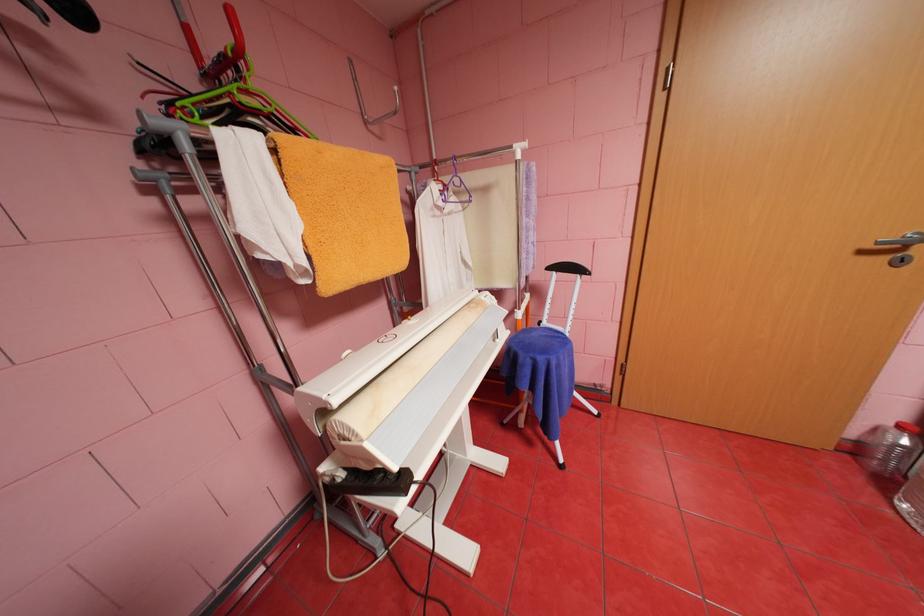
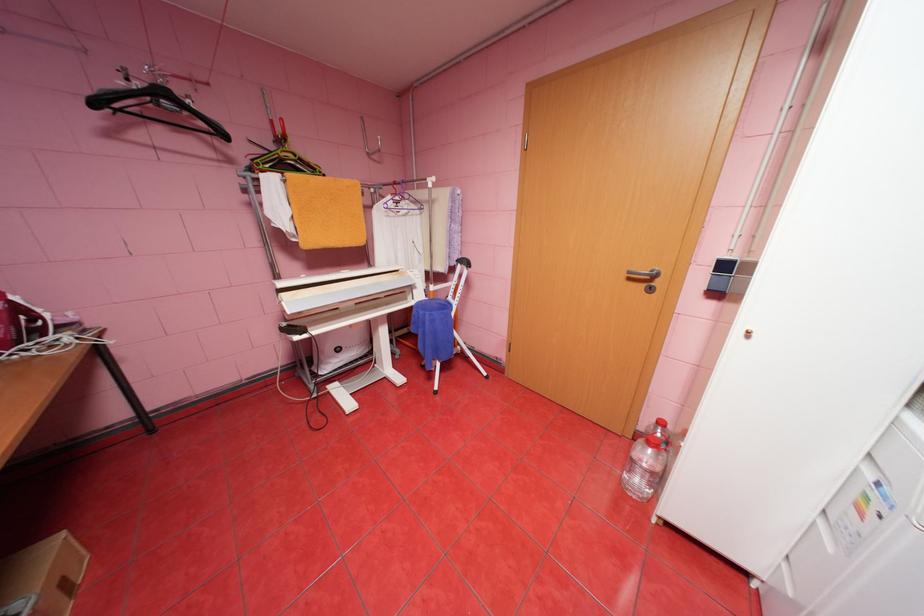
Find the pixel in the second image that matches (374,123) in the first image.

(377, 154)